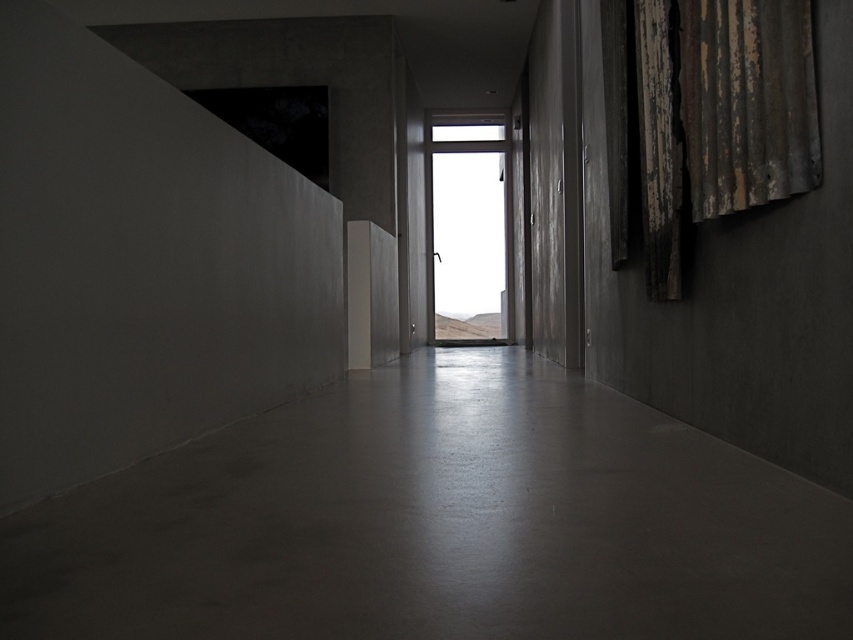
Question: From the image, what is the correct spatial relationship of rusty corrugated metal curtain at right in relation to transparent glass window at center?

Choices:
 (A) right
 (B) left

Answer: (A)

Question: In this image, where is smooth concrete floor at center located relative to transparent glass window at center?

Choices:
 (A) above
 (B) below

Answer: (B)

Question: Which of the following is the closest to the observer?

Choices:
 (A) (476, 492)
 (B) (695, 99)

Answer: (A)

Question: Estimate the real-world distances between objects in this image. Which object is closer to the smooth concrete floor at center?

Choices:
 (A) transparent glass window at center
 (B) rusty corrugated metal curtain at right

Answer: (B)

Question: Which of these objects is positioned farthest from the smooth concrete floor at center?

Choices:
 (A) rusty corrugated metal curtain at right
 (B) transparent glass window at center

Answer: (B)

Question: Does smooth concrete floor at center come behind rusty corrugated metal curtain at right?

Choices:
 (A) no
 (B) yes

Answer: (A)